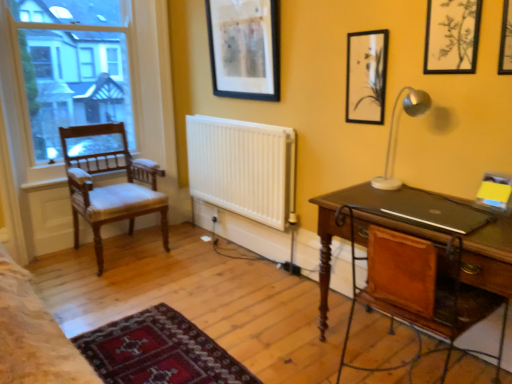
Image resolution: width=512 pixels, height=384 pixels. Identify the location of vacant space behind black matte laptop at right. (388, 190).